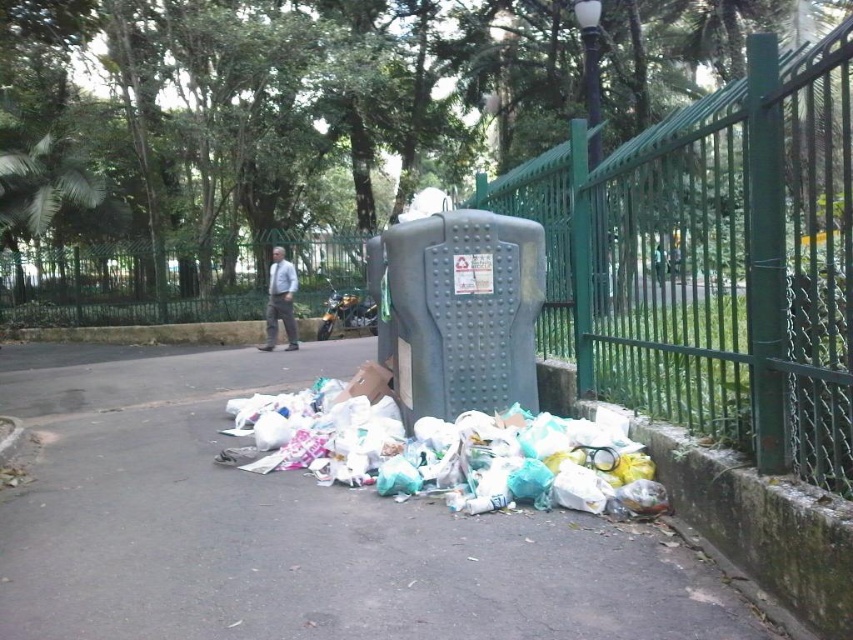
Does green metal fence at upper right appear on the left side of matte gray pants at center?

In fact, green metal fence at upper right is to the right of matte gray pants at center.

Locate an element on the screen. This screenshot has width=853, height=640. green metal fence at upper right is located at coordinates (712, 260).

The width and height of the screenshot is (853, 640). In order to click on green metal fence at upper right in this screenshot , I will do `click(712, 260)`.

Is point (235, 273) positioned before point (287, 278)?

No, it is not.

You are a GUI agent. You are given a task and a screenshot of the screen. Output one action in this format:
    pyautogui.click(x=<x>, y=<y>)
    Task: Click on the green metal fence at center
    This screenshot has width=853, height=640.
    Given the screenshot: What is the action you would take?
    pyautogui.click(x=132, y=284)

Is trashy asphalt pavement at lower center below matte gray pants at center?

Correct, trashy asphalt pavement at lower center is located below matte gray pants at center.

Looking at this image, is trashy asphalt pavement at lower center wider than matte gray pants at center?

Yes, trashy asphalt pavement at lower center is wider than matte gray pants at center.

At what (x,y) coordinates should I click in order to perform the action: click on trashy asphalt pavement at lower center. Please return your answer as a coordinate pair (x, y). The width and height of the screenshot is (853, 640). Looking at the image, I should click on (292, 529).

The image size is (853, 640). In order to click on trashy asphalt pavement at lower center in this screenshot , I will do (x=292, y=529).